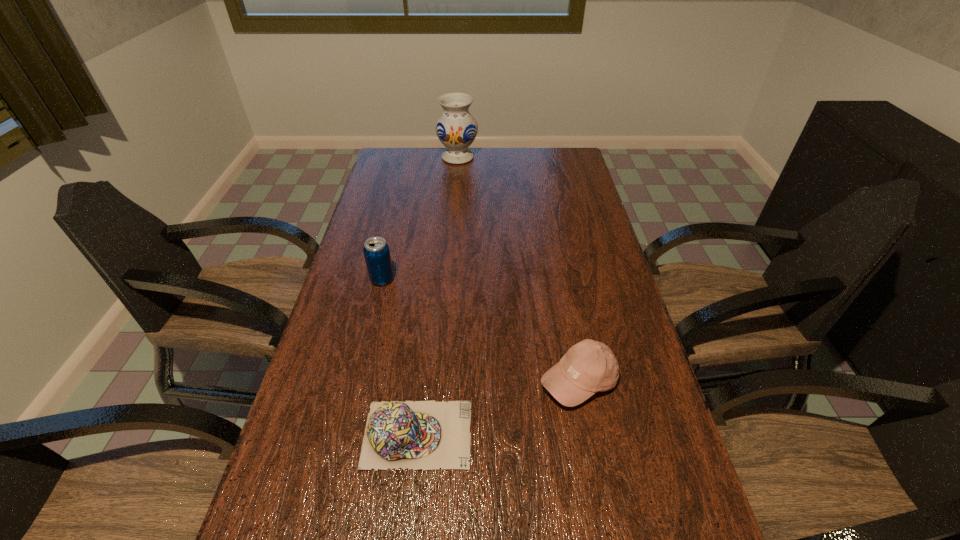
Identify which object is the third closest to the tallest object. Please provide its 2D coordinates. Your answer should be formatted as a tuple, i.e. [(x, y)], where the tuple contains the x and y coordinates of a point satisfying the conditions above.

[(427, 435)]

At what (x,y) coordinates should I click in order to perform the action: click on the closest object relative to the shortest object. Please return your answer as a coordinate pair (x, y). This screenshot has width=960, height=540. Looking at the image, I should click on (589, 366).

Locate an element on the screen. The image size is (960, 540). vacant space that satisfies the following two spatial constraints: 1. on the front-facing side of the baseball cap; 2. on the front, side, and top of the cap is located at coordinates (589, 434).

The height and width of the screenshot is (540, 960). I want to click on vacant region that satisfies the following two spatial constraints: 1. on the front-facing side of the baseball cap; 2. on the front, side, and top of the cap, so click(589, 434).